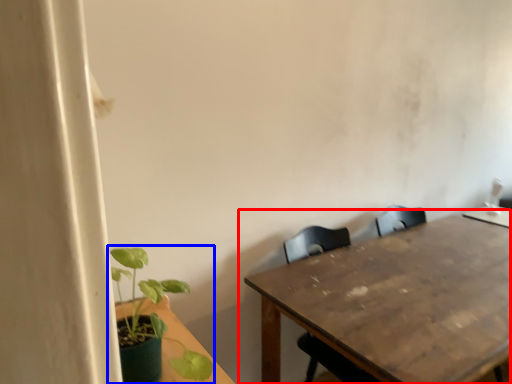
Question: Which object appears closest to the camera in this image, table (highlighted by a red box) or houseplant (highlighted by a blue box)?

Choices:
 (A) table
 (B) houseplant

Answer: (B)